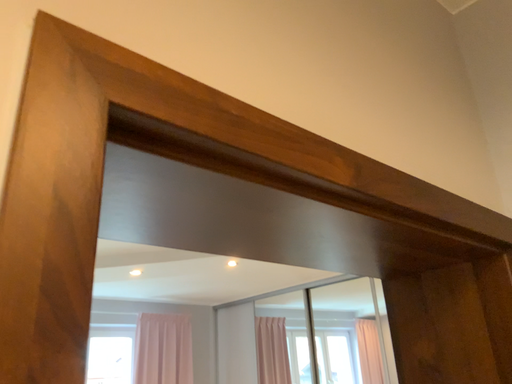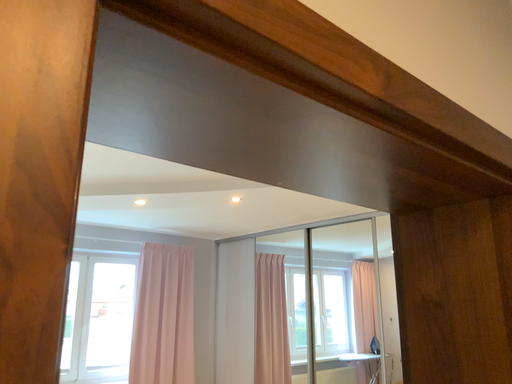
Question: How did the camera likely rotate when shooting the video?

Choices:
 (A) rotated downward
 (B) rotated upward

Answer: (A)